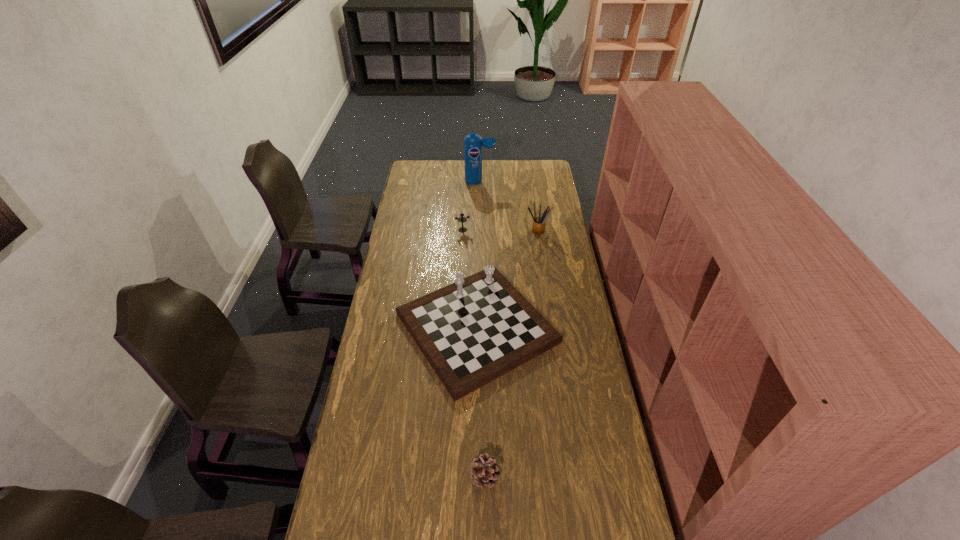
The height and width of the screenshot is (540, 960). What are the coordinates of `the tallest object` in the screenshot? It's located at (473, 143).

The width and height of the screenshot is (960, 540). I want to click on the farthest object, so click(473, 143).

Where is `pencil box`? Image resolution: width=960 pixels, height=540 pixels. pencil box is located at coordinates (539, 222).

Where is `gameboard`? The image size is (960, 540). gameboard is located at coordinates (473, 331).

You are a GUI agent. You are given a task and a screenshot of the screen. Output one action in this format:
    pyautogui.click(x=<x>, y=<y>)
    Task: Click on the candle holder
    
    Given the screenshot: What is the action you would take?
    pyautogui.click(x=462, y=219)

The width and height of the screenshot is (960, 540). Find the location of `the nearest object`. the nearest object is located at coordinates (484, 469).

Locate an element on the screen. pinecone is located at coordinates (484, 469).

Identify the location of vacant space located on the front of the farthest object. The image size is (960, 540). pos(480,201).

In order to click on free space located on the front of the pencil box in this screenshot , I will do `click(544, 275)`.

Locate an element on the screen. Image resolution: width=960 pixels, height=540 pixels. vacant space located on the back of the gameboard is located at coordinates (477, 230).